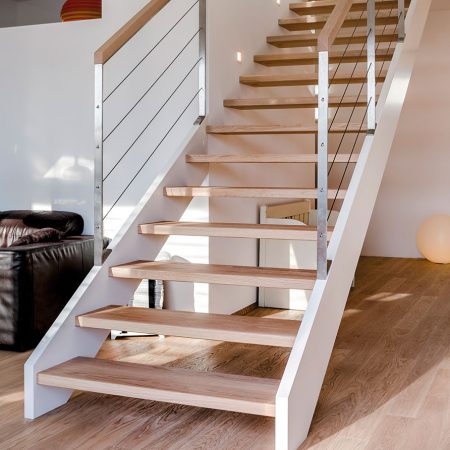
Locate an element on the screen. The height and width of the screenshot is (450, 450). stair rails is located at coordinates (99, 126), (201, 44), (321, 118), (400, 5), (370, 46).